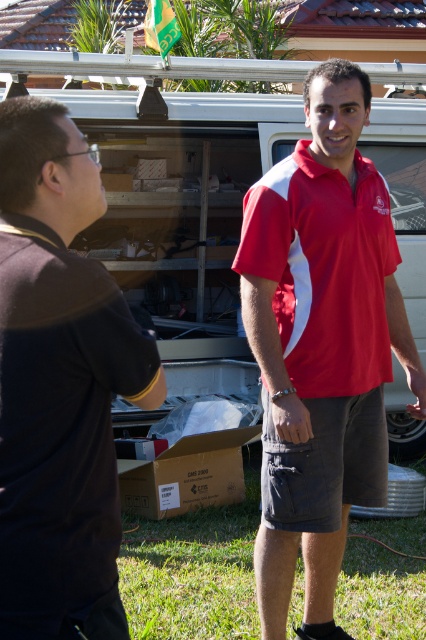
Question: Which point appears closest to the camera in this image?

Choices:
 (A) (186, 307)
 (B) (77, 305)
 (C) (278, 221)
 (D) (284, 380)

Answer: (B)

Question: Considering the relative positions of brown matte shirt at left and matte red polo shirt at center in the image provided, where is brown matte shirt at left located with respect to matte red polo shirt at center?

Choices:
 (A) right
 (B) left

Answer: (B)

Question: Among these points, which one is nearest to the camera?

Choices:
 (A) (383, 355)
 (B) (353, 211)
 (C) (46, 333)
 (D) (74, 76)

Answer: (C)

Question: Does brown matte shirt at left appear over matte black truck at center?

Choices:
 (A) yes
 (B) no

Answer: (B)

Question: Among these points, which one is nearest to the camera?

Choices:
 (A) pyautogui.click(x=367, y=362)
 (B) pyautogui.click(x=135, y=253)
 (C) pyautogui.click(x=327, y=129)
 (D) pyautogui.click(x=66, y=586)

Answer: (D)

Question: Does matte black truck at center appear under matte red polo shirt at center?

Choices:
 (A) yes
 (B) no

Answer: (B)